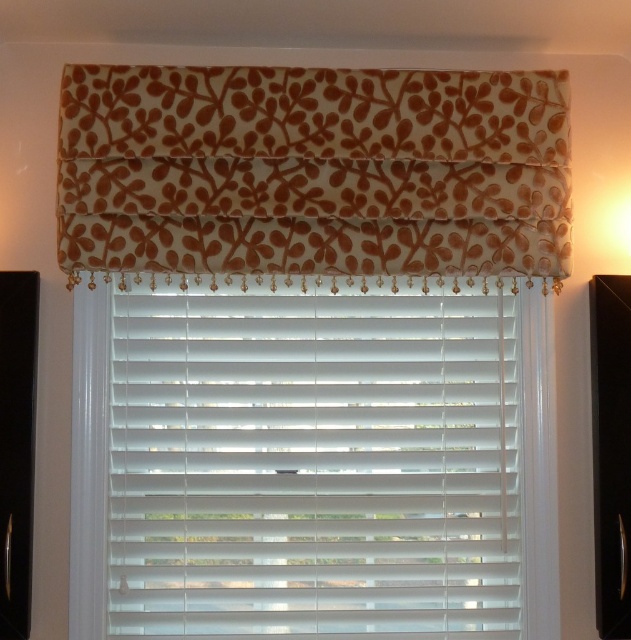
You are an interior designer assessing the window decor. You need to determine if the white matte blinds at center can be placed behind the brown floral fabric valance at upper center without being visible. Based on their sizes, can the blinds be hidden?

The white matte blinds at center is thinner than the brown floral fabric valance at upper center, so yes, the blinds can be placed behind the valance and remain hidden since the valance is wider.

You are an interior designer assessing the window decor. You notice the white matte blinds at center and the brown floral fabric valance at upper center. Which one has a greater height?

The white matte blinds at center is taller than the brown floral fabric valance at upper center according to the description.

You are standing in front of the window and want to adjust the white matte blinds at center. Which direction should you move your hand to align them with the brown floral fabric valance at upper center?

The white matte blinds at center is to the right of the brown floral fabric valance at upper center, so you should move your hand to the left to align them.